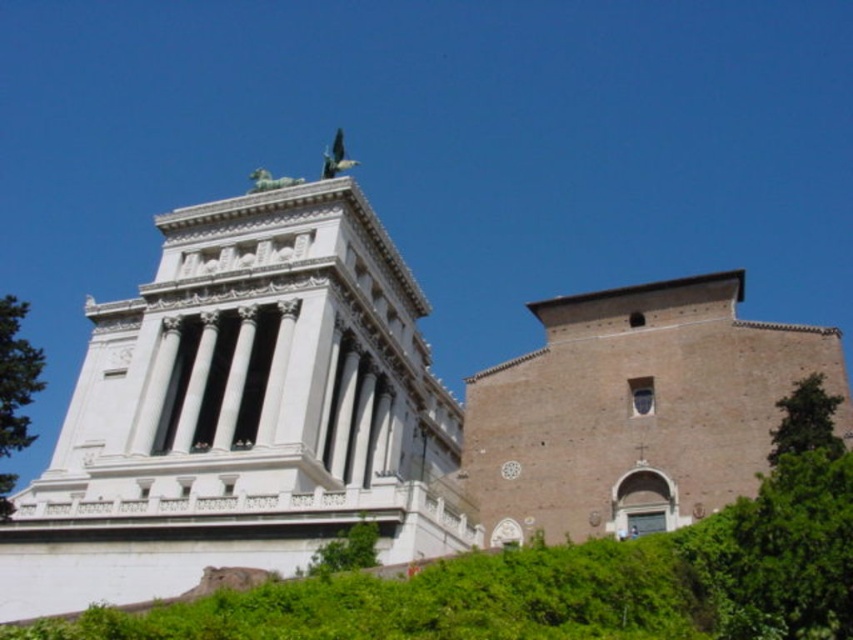
Based on the photo, who is positioned more to the right, white marble tower at upper left or green leafy tree at left?

white marble tower at upper left

Does white marble tower at upper left appear over green leafy tree at left?

Yes, white marble tower at upper left is above green leafy tree at left.

Is point (126, 397) positioned before point (9, 344)?

No, it is behind (9, 344).

Locate an element on the screen. The image size is (853, 640). white marble tower at upper left is located at coordinates (242, 410).

Can you confirm if white marble tower at upper left is thinner than green leafy tree at right?

Incorrect, white marble tower at upper left's width is not less than green leafy tree at right's.

Does white marble tower at upper left appear on the left side of green leafy tree at right?

Correct, you'll find white marble tower at upper left to the left of green leafy tree at right.

Locate an element on the screen. Image resolution: width=853 pixels, height=640 pixels. white marble tower at upper left is located at coordinates (242, 410).

Looking at this image, between white marble tower at upper left and green leafy tree at lower center, which one has less height?

With less height is green leafy tree at lower center.

Can you confirm if white marble tower at upper left is positioned above green leafy tree at lower center?

Indeed, white marble tower at upper left is positioned over green leafy tree at lower center.

Between point (421, 513) and point (358, 531), which one is positioned in front?

Point (358, 531) is more forward.

Image resolution: width=853 pixels, height=640 pixels. I want to click on white marble tower at upper left, so click(242, 410).